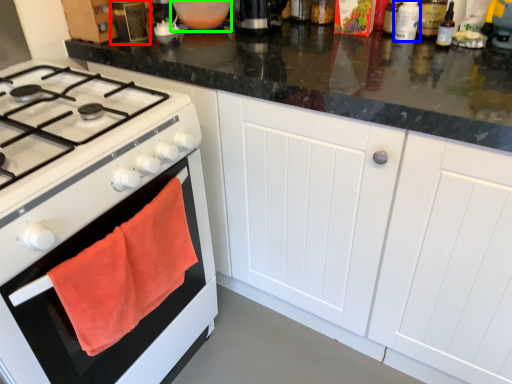
Question: Considering the real-world distances, which object is closest to kitchen appliance (highlighted by a red box)? bottle (highlighted by a blue box) or appliance (highlighted by a green box).

Choices:
 (A) bottle
 (B) appliance

Answer: (B)